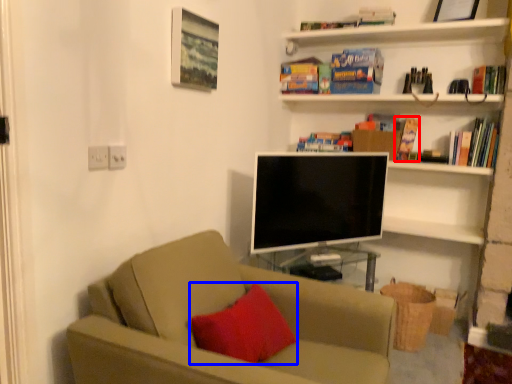
Question: Which object is further to the camera taking this photo, paperback book (highlighted by a red box) or throw pillow (highlighted by a blue box)?

Choices:
 (A) paperback book
 (B) throw pillow

Answer: (A)